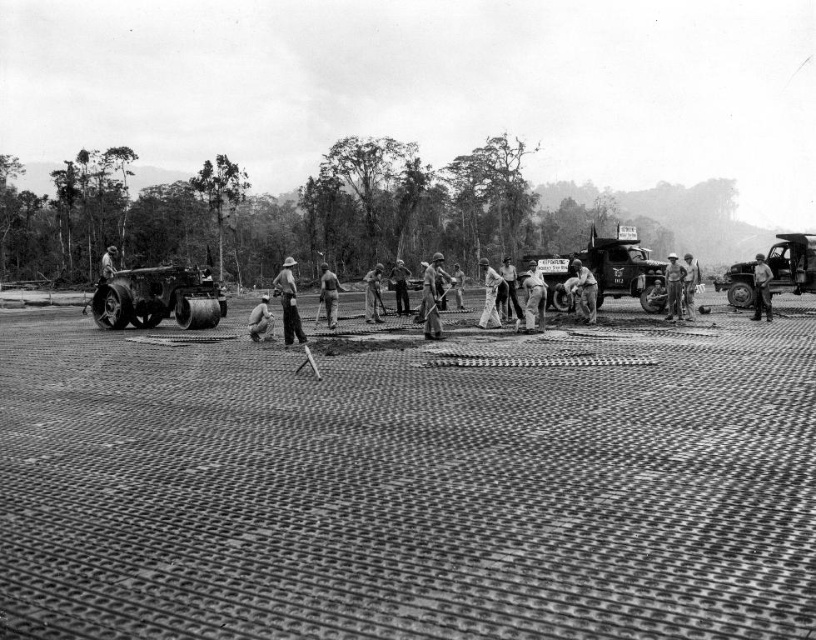
Is point (194, 312) positioned in front of point (765, 272)?

That is False.

Image resolution: width=816 pixels, height=640 pixels. I want to click on matte black roller at left, so click(x=157, y=298).

Does light brown uniform at center appear under light brown wooden shovel at center?

Yes, light brown uniform at center is below light brown wooden shovel at center.

From the picture: Is light brown uniform at center positioned behind light brown wooden shovel at center?

That is False.

Between point (757, 310) and point (377, 273), which one is positioned behind?

Positioned behind is point (377, 273).

Where is `light brown uniform at center`? light brown uniform at center is located at coordinates (761, 289).

Is matte black roller at left wider than light brown wooden shovel at center?

Indeed, matte black roller at left has a greater width compared to light brown wooden shovel at center.

Is matte black roller at left to the left of light brown wooden shovel at center from the viewer's perspective?

Indeed, matte black roller at left is positioned on the left side of light brown wooden shovel at center.

Based on the photo, who is more distant from viewer, (167, 273) or (380, 273)?

The point (380, 273) is more distant.

Locate an element on the screen. The image size is (816, 640). matte black roller at left is located at coordinates (157, 298).